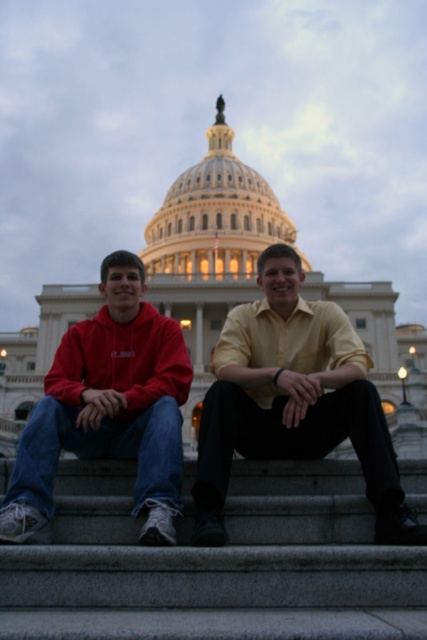
You are standing at the entrance of the United States Capitol Building and want to take a photo of the yellow satin shirt at center. Where should you position yourself to capture it in the frame?

To capture the yellow satin shirt at center in your photo, position yourself at the entrance of the United States Capitol Building and aim your camera towards the coordinates point (294,401) where the yellow satin shirt at center is located.